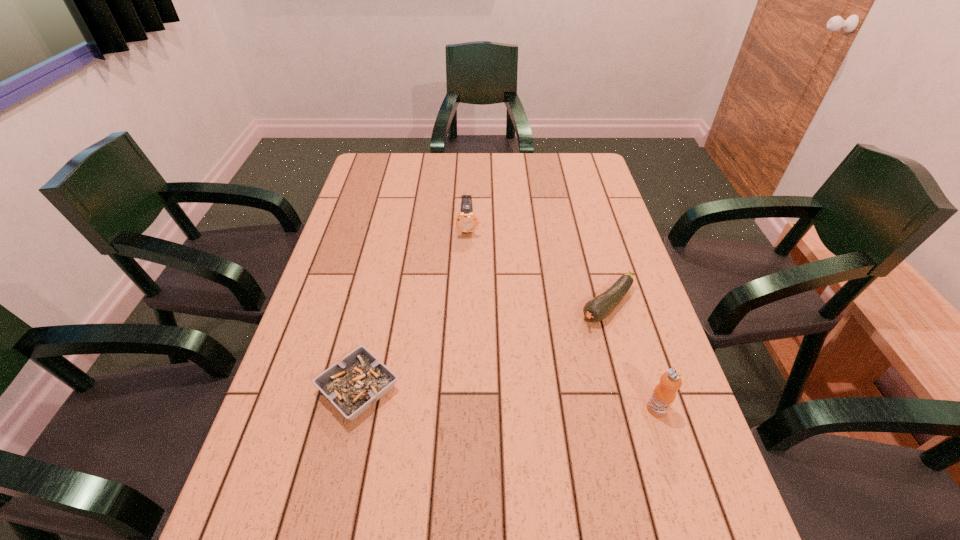
The height and width of the screenshot is (540, 960). Find the location of `free location located on the face of the third shortest object`. free location located on the face of the third shortest object is located at coordinates (469, 318).

You are a GUI agent. You are given a task and a screenshot of the screen. Output one action in this format:
    pyautogui.click(x=<x>, y=<y>)
    Task: Click on the free space located on the face of the third shortest object
    
    Given the screenshot: What is the action you would take?
    pyautogui.click(x=469, y=287)

Find the location of a particular element. free point located at the blossom end of the third tallest object is located at coordinates (509, 389).

Find the location of a particular element. free space located at the blossom end of the third tallest object is located at coordinates (495, 400).

The height and width of the screenshot is (540, 960). In order to click on vacant position located at the blossom end of the third tallest object in this screenshot , I will do (516, 384).

The image size is (960, 540). In order to click on object positioned at the left edge in this screenshot , I will do `click(353, 385)`.

You are a GUI agent. You are given a task and a screenshot of the screen. Output one action in this format:
    pyautogui.click(x=<x>, y=<y>)
    Task: Click on the orange juice positioned at the right edge
    This screenshot has width=960, height=540.
    Given the screenshot: What is the action you would take?
    pyautogui.click(x=664, y=394)

This screenshot has width=960, height=540. In order to click on zucchini at the right edge in this screenshot , I will do `click(597, 309)`.

Locate an element on the screen. The height and width of the screenshot is (540, 960). free region at the far edge of the desktop is located at coordinates (531, 156).

This screenshot has width=960, height=540. Find the location of `vacant space at the near edge of the desktop`. vacant space at the near edge of the desktop is located at coordinates (394, 491).